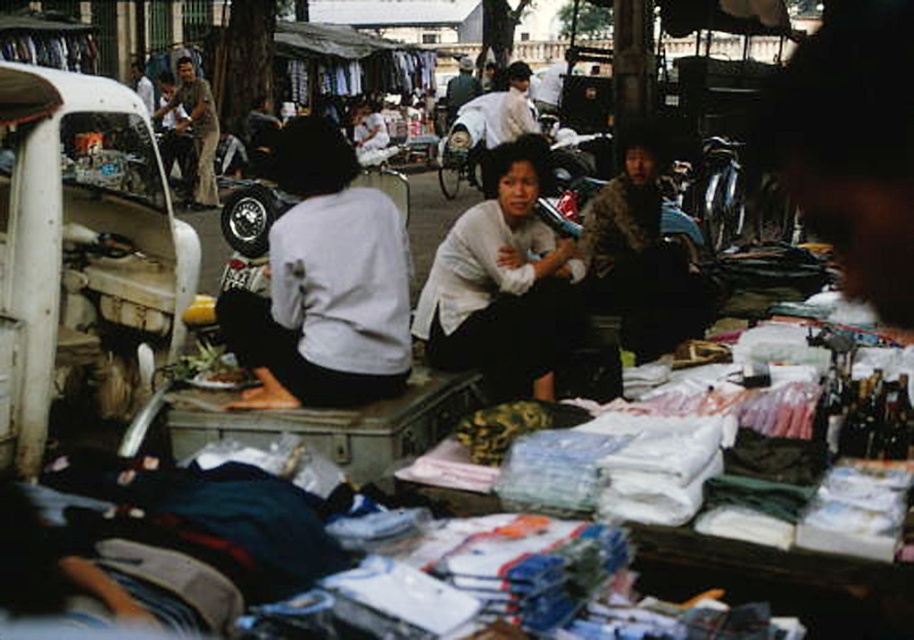
Does camouflage jacket at center appear on the left side of brown textured shirt at upper left?

No, camouflage jacket at center is not to the left of brown textured shirt at upper left.

Where is `camouflage jacket at center`? The image size is (914, 640). camouflage jacket at center is located at coordinates (639, 257).

Which is behind, point (609, 211) or point (211, 132)?

The point (211, 132) is behind.

You are a GUI agent. You are given a task and a screenshot of the screen. Output one action in this format:
    pyautogui.click(x=<x>, y=<y>)
    Task: Click on the camouflage jacket at center
    
    Given the screenshot: What is the action you would take?
    pyautogui.click(x=639, y=257)

Does white matte sweater at center have a greater width compared to dark gray fabric jacket at center?

Yes.

Does white matte sweater at center come behind dark gray fabric jacket at center?

No, it is not.

I want to click on white matte sweater at center, so click(x=503, y=282).

The height and width of the screenshot is (640, 914). I want to click on white matte sweater at center, so click(503, 282).

Between white matte sweater at center and brown textured shirt at upper left, which one is positioned higher?

Positioned higher is brown textured shirt at upper left.

Between point (462, 259) and point (203, 141), which one is positioned behind?

The point (203, 141) is more distant.

Locate an element on the screen. This screenshot has height=640, width=914. white matte sweater at center is located at coordinates (503, 282).